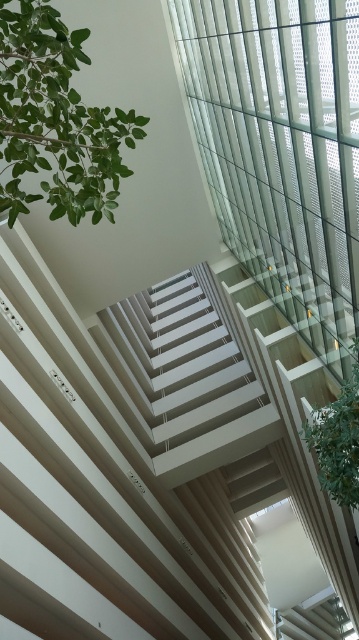
Question: Which object appears closest to the camera in this image?

Choices:
 (A) green leafy plant at upper left
 (B) green leafy plant at upper right

Answer: (A)

Question: Does green leafy plant at upper left appear on the right side of green leafy plant at upper right?

Choices:
 (A) yes
 (B) no

Answer: (B)

Question: Is green leafy plant at upper left thinner than green leafy plant at upper right?

Choices:
 (A) yes
 (B) no

Answer: (B)

Question: Is green leafy plant at upper left below green leafy plant at upper right?

Choices:
 (A) no
 (B) yes

Answer: (A)

Question: Which of the following is the farthest from the observer?

Choices:
 (A) green leafy plant at upper left
 (B) green leafy plant at upper right

Answer: (B)

Question: Which point appears farthest from the camera in this image?

Choices:
 (A) (350, 497)
 (B) (15, 44)

Answer: (A)